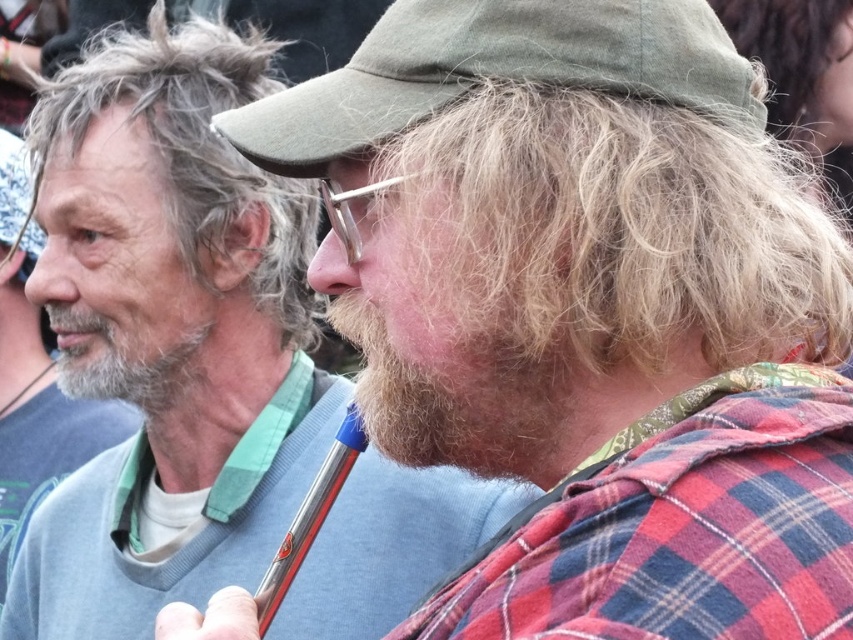
Question: In this image, where is red plaid shirt at right located relative to graywoollybeard at left?

Choices:
 (A) below
 (B) above

Answer: (A)

Question: Which of these objects is positioned closest to the brown fuzzy beard at center?

Choices:
 (A) gray beard at left
 (B) green fabric cap at center
 (C) flannel shirt at center

Answer: (B)

Question: Which object is farther from the camera taking this photo?

Choices:
 (A) flannel shirt at center
 (B) gray beard at left
 (C) green fabric cap at center

Answer: (B)

Question: Is grayish blonde hair at upper left to the right of brown fuzzy beard at center from the viewer's perspective?

Choices:
 (A) yes
 (B) no

Answer: (B)

Question: Does grayish blonde hair at upper left appear under brown fuzzy beard at center?

Choices:
 (A) no
 (B) yes

Answer: (A)

Question: Considering the real-world distances, which object is closest to the graywoollybeard at left?

Choices:
 (A) grayish blonde hair at upper left
 (B) green fabric cap at center
 (C) flannel shirt at center

Answer: (C)